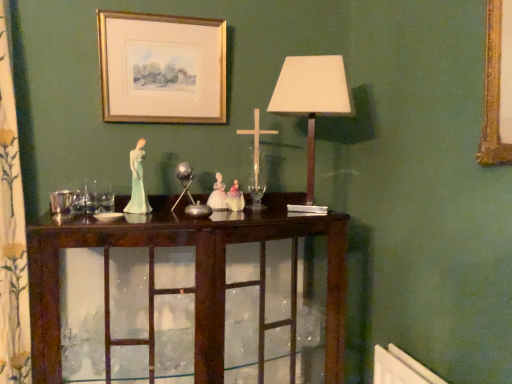
This screenshot has height=384, width=512. In order to click on free space to the left of matte white lampshade at center in this screenshot , I will do `click(252, 215)`.